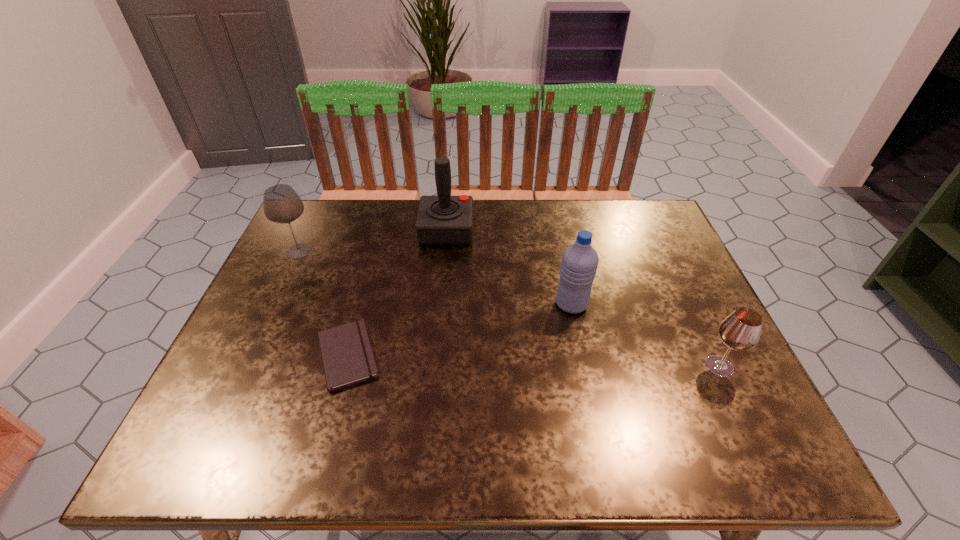
Image resolution: width=960 pixels, height=540 pixels. Find the location of `vacant space at the near edge of the desktop`. vacant space at the near edge of the desktop is located at coordinates (531, 462).

You are a GUI agent. You are given a task and a screenshot of the screen. Output one action in this format:
    pyautogui.click(x=<x>, y=<y>)
    Task: Click on the vacant space at the left edge of the desktop
    Image resolution: width=960 pixels, height=540 pixels.
    Given the screenshot: What is the action you would take?
    pyautogui.click(x=234, y=390)

Identify the location of free space at the right edge of the desktop. (693, 312).

In the image, there is a desktop. At what (x,y) coordinates should I click in order to perform the action: click on vacant space at the far left corner. Please return your answer as a coordinate pair (x, y). This screenshot has height=540, width=960. Looking at the image, I should click on (337, 224).

Identify the location of free spot at the far right corner of the desktop. (622, 207).

The height and width of the screenshot is (540, 960). In order to click on vacant point located between the shortest object and the joystick in this screenshot , I will do `click(396, 293)`.

Locate an element on the screen. This screenshot has width=960, height=540. vacant area that lies between the second object from left to right and the left wineglass is located at coordinates click(x=324, y=303).

Locate an element on the screen. free space between the checkbook and the rightmost object is located at coordinates (533, 361).

The width and height of the screenshot is (960, 540). Find the location of `vacant point located between the third farthest object and the farther wineglass`. vacant point located between the third farthest object and the farther wineglass is located at coordinates (435, 278).

Find the location of a particular element. The height and width of the screenshot is (540, 960). free area in between the water bottle and the shorter wineglass is located at coordinates (645, 335).